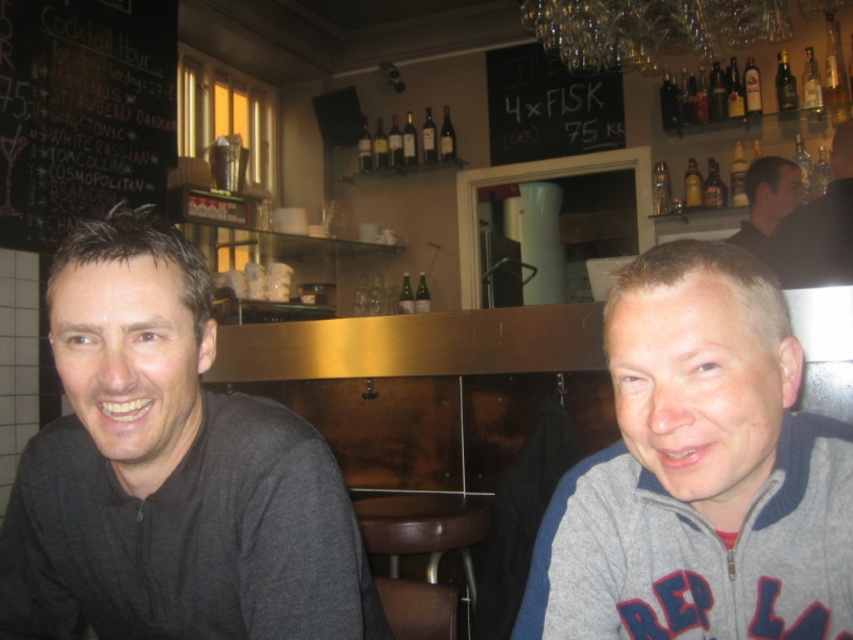
You are a delivery person who needs to place a small package between the gray fleece jacket at lower right and the brown leather stool at center. Can the package fit in the space between them?

The gray fleece jacket at lower right has a lesser width compared to brown leather stool at center. The space between them may be sufficient for the small package, but the exact fit depends on the package size. Since the jacket is narrower, there might be enough space, but without knowing the package dimensions, we can only assume it might fit.